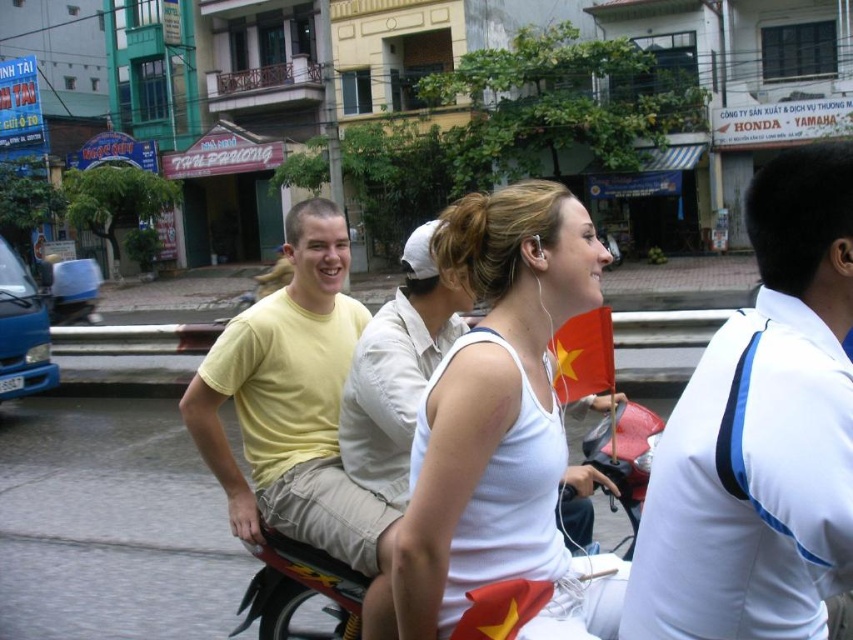
Which is below, white matte tank top at center or yellow t-shirt at center?

Positioned lower is yellow t-shirt at center.

Can you confirm if white matte tank top at center is positioned to the right of yellow t-shirt at center?

Correct, you'll find white matte tank top at center to the right of yellow t-shirt at center.

This screenshot has width=853, height=640. I want to click on white matte tank top at center, so 502,420.

Does yellow t-shirt at center come behind metallic red motorcycle at center?

No, it is not.

Describe the element at coordinates (296, 412) in the screenshot. I see `yellow t-shirt at center` at that location.

Is point (310, 509) behind point (625, 554)?

No.

Locate an element on the screen. The image size is (853, 640). yellow t-shirt at center is located at coordinates (296, 412).

How much distance is there between white smooth shirt at right and metallic red motorcycle at center?

The distance of white smooth shirt at right from metallic red motorcycle at center is 1.36 meters.

Is point (837, 282) positioned after point (659, 428)?

No, (837, 282) is closer to viewer.

Find the location of a particular element. The width and height of the screenshot is (853, 640). white smooth shirt at right is located at coordinates (761, 435).

Where is `white smooth shirt at right`? white smooth shirt at right is located at coordinates (761, 435).